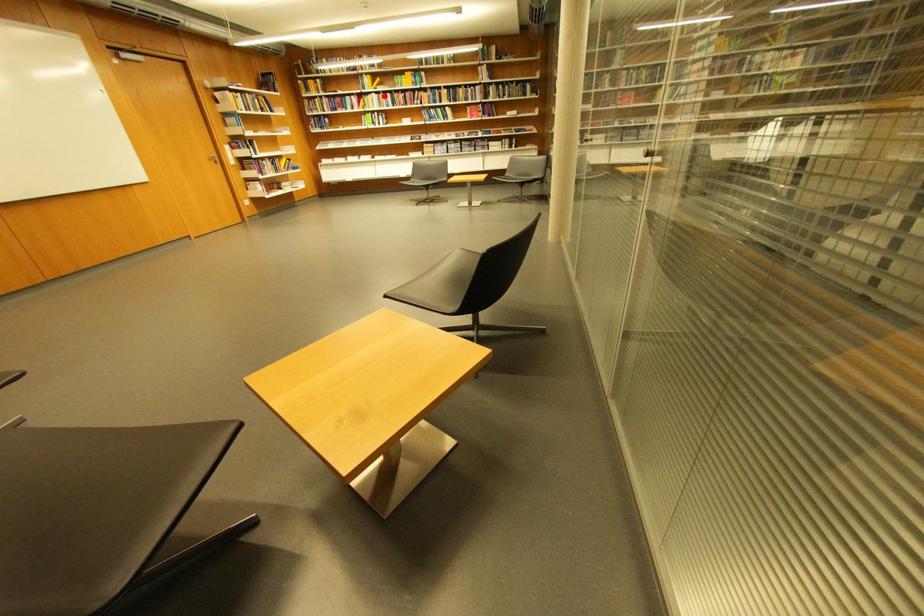
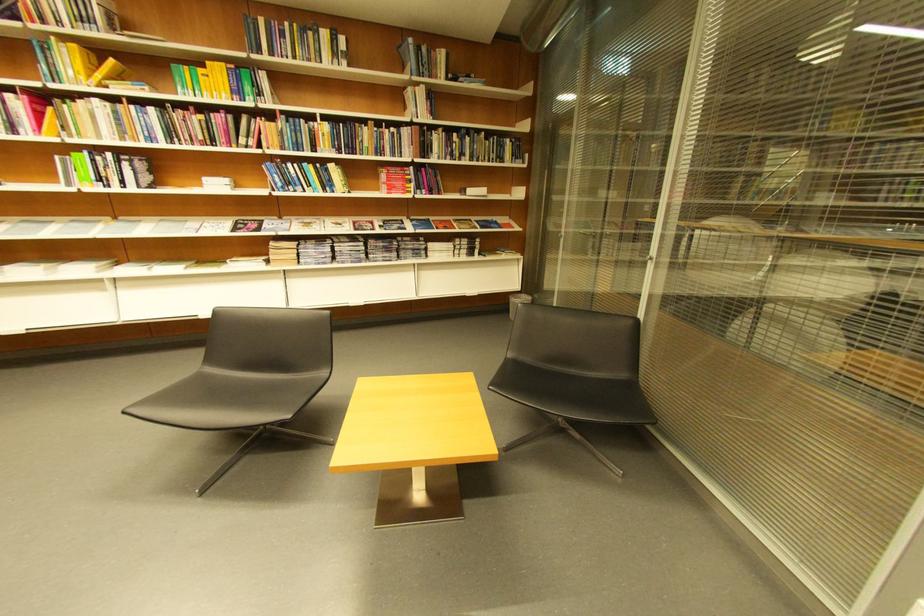
Question: A red point is marked in image1. In image2, is the corresponding 3D point closer to the camera or farther? Reply with the corresponding letter.

Choices:
 (A) The corresponding 3D point is closer.
 (B) The corresponding 3D point is farther.

Answer: (B)